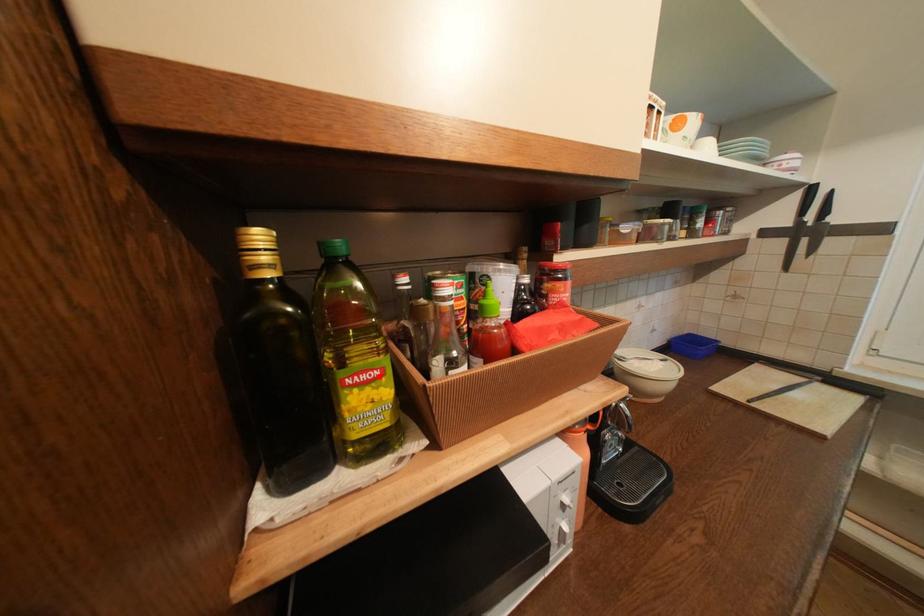
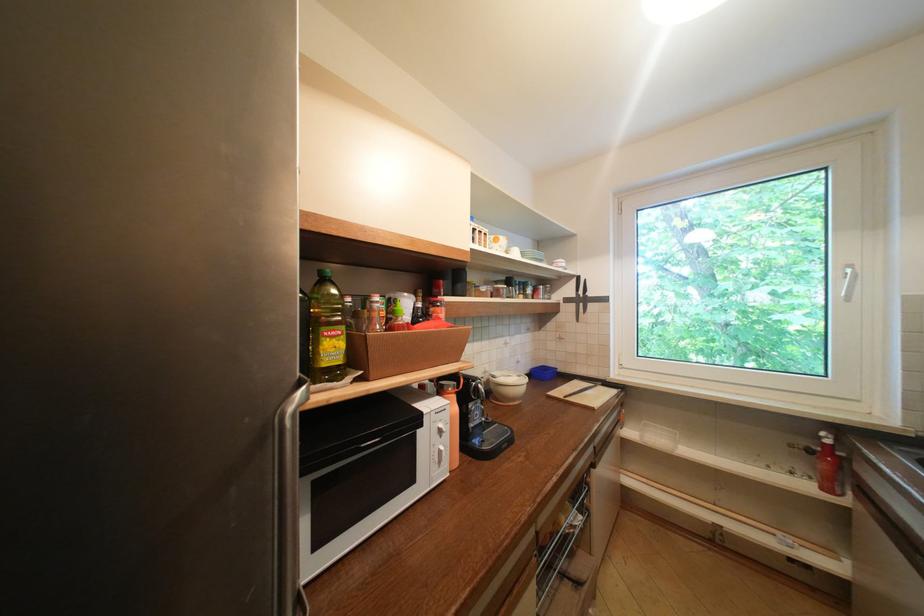
Locate, in the second image, the point that corresponds to the highlighted location in the first image.

(345, 334)